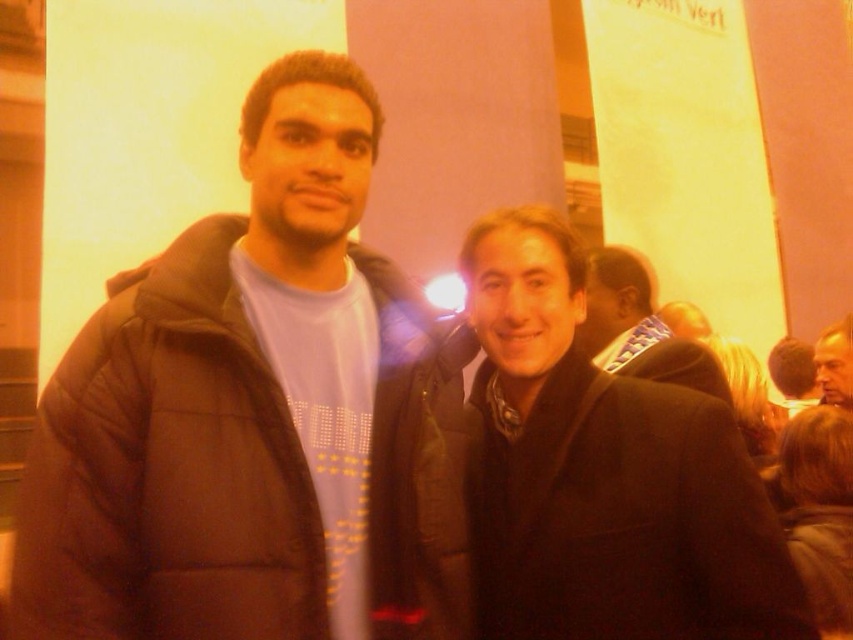
Question: Which object appears closest to the camera in this image?

Choices:
 (A) black matte coat at center
 (B) smooth gray jacket at upper right
 (C) black puffy jacket at left
 (D) matte black jacket at center

Answer: (C)

Question: Can you confirm if black matte coat at center is wider than matte black jacket at center?

Choices:
 (A) yes
 (B) no

Answer: (A)

Question: Is black puffy jacket at left smaller than matte black jacket at center?

Choices:
 (A) yes
 (B) no

Answer: (B)

Question: Among these objects, which one is farthest from the camera?

Choices:
 (A) matte black jacket at center
 (B) smooth gray jacket at upper right

Answer: (B)

Question: Which object appears farthest from the camera in this image?

Choices:
 (A) matte black jacket at center
 (B) black matte coat at center
 (C) smooth gray jacket at upper right
 (D) black puffy jacket at left

Answer: (C)

Question: Does black matte coat at center have a smaller size compared to matte black jacket at center?

Choices:
 (A) yes
 (B) no

Answer: (B)